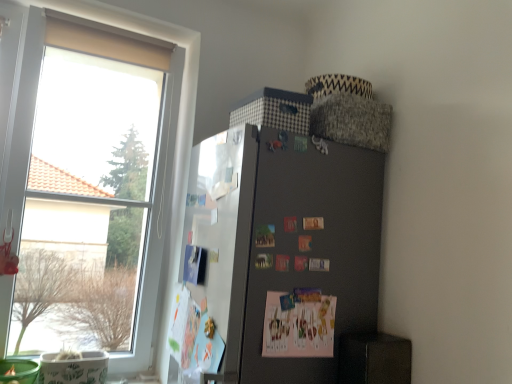
What do you see at coordinates (90, 156) in the screenshot? I see `transparent glass window at left` at bounding box center [90, 156].

Locate an element on the screen. The width and height of the screenshot is (512, 384). pink paper postcard at center is located at coordinates (298, 326).

Measure the distance between white paperboard at left and camera.

white paperboard at left and camera are 4.53 feet apart.

This screenshot has width=512, height=384. Find the location of `transparent glass window at left`. transparent glass window at left is located at coordinates pyautogui.click(x=90, y=156).

Based on the photo, considering the relative sizes of transparent glass window at left and white paperboard at left in the image provided, is transparent glass window at left shorter than white paperboard at left?

No, transparent glass window at left is not shorter than white paperboard at left.

Is transparent glass window at left to the left or to the right of white paperboard at left in the image?

transparent glass window at left is positioned on white paperboard at left's left side.

This screenshot has width=512, height=384. I want to click on bulletin board located underneath the transparent glass window at left (from a real-world perspective), so click(214, 259).

Is transparent glass window at left aimed at white paperboard at left?

Yes, transparent glass window at left is oriented towards white paperboard at left.

Is point (267, 360) positioned in front of point (196, 149)?

Yes, point (267, 360) is closer to viewer.

From the image's perspective, is satin black fridge at upper right located beneath white paperboard at left?

Indeed, from the image's perspective, satin black fridge at upper right is shown beneath white paperboard at left.

How different are the orientations of satin black fridge at upper right and white paperboard at left in degrees?

0.508 degrees separate the facing orientations of satin black fridge at upper right and white paperboard at left.

From a real-world perspective, is satin black fridge at upper right positioned over white paperboard at left based on gravity?

No, from a real-world perspective, satin black fridge at upper right is not over white paperboard at left

Which object is positioned more to the left, transparent glass window at left or pink paper postcard at center?

Positioned to the left is transparent glass window at left.

The width and height of the screenshot is (512, 384). In order to click on postcard on the right of transparent glass window at left in this screenshot , I will do `click(298, 326)`.

Is there a large distance between transparent glass window at left and pink paper postcard at center?

Yes.

From a real-world perspective, is transparent glass window at left positioned under pink paper postcard at center based on gravity?

No, from a real-world perspective, transparent glass window at left is not under pink paper postcard at center.

Which is correct: white paperboard at left is inside satin black fridge at upper right, or outside of it?

white paperboard at left fits inside satin black fridge at upper right.

From a real-world perspective, is white paperboard at left located beneath satin black fridge at upper right?

No.

Is white paperboard at left not close to satin black fridge at upper right?

Actually, white paperboard at left and satin black fridge at upper right are a little close together.

Looking at their sizes, would you say satin black fridge at upper right is wider or thinner than pink paper postcard at center?

satin black fridge at upper right is wider than pink paper postcard at center.

The height and width of the screenshot is (384, 512). In order to click on postcard that appears on the right of satin black fridge at upper right in this screenshot , I will do `click(298, 326)`.

From a real-world perspective, who is located higher, satin black fridge at upper right or pink paper postcard at center?

In real-world perspective, satin black fridge at upper right is above.

Is satin black fridge at upper right further to camera compared to pink paper postcard at center?

That is False.

Find the location of a particular element. The width and height of the screenshot is (512, 384). window above the pink paper postcard at center (from a real-world perspective) is located at coordinates (90, 156).

From the image's perspective, relative to transparent glass window at left, is pink paper postcard at center above or below?

pink paper postcard at center is situated lower than transparent glass window at left in the image.

Which object is wider, pink paper postcard at center or transparent glass window at left?

transparent glass window at left is wider.

From a real-world perspective, relative to satin black fridge at upper right, is pink paper postcard at center vertically above or below?

From a real-world perspective, pink paper postcard at center is physically below satin black fridge at upper right.

Is satin black fridge at upper right at the back of pink paper postcard at center?

Yes, pink paper postcard at center is positioned with its back facing satin black fridge at upper right.

What's the angular difference between pink paper postcard at center and satin black fridge at upper right's facing directions?

90.9 degrees.

From the image's perspective, which object appears higher, pink paper postcard at center or satin black fridge at upper right?

satin black fridge at upper right appears higher in the image.

You are a GUI agent. You are given a task and a screenshot of the screen. Output one action in this format:
    pyautogui.click(x=<x>, y=<y>)
    Task: Click on the window located behind the white paperboard at left
    The width and height of the screenshot is (512, 384).
    Given the screenshot: What is the action you would take?
    pyautogui.click(x=90, y=156)

Find the location of a particular element. The width and height of the screenshot is (512, 384). refrigerator lying on the right of white paperboard at left is located at coordinates (276, 256).

From the image, which object appears to be nearer to transparent glass window at left, satin black fridge at upper right or white paperboard at left?

white paperboard at left lies closer to transparent glass window at left than the other object.

Estimate the real-world distances between objects in this image. Which object is closer to pink paper postcard at center, transparent glass window at left or satin black fridge at upper right?

satin black fridge at upper right is positioned closer to the anchor pink paper postcard at center.

Estimate the real-world distances between objects in this image. Which object is closer to transparent glass window at left, pink paper postcard at center or satin black fridge at upper right?

Among the two, satin black fridge at upper right is located nearer to transparent glass window at left.

From the picture: From the image, which object appears to be farther from white paperboard at left, satin black fridge at upper right or transparent glass window at left?

Based on the image, transparent glass window at left appears to be further to white paperboard at left.

When comparing their distances from transparent glass window at left, does white paperboard at left or pink paper postcard at center seem further?

pink paper postcard at center.

Estimate the real-world distances between objects in this image. Which object is further from pink paper postcard at center, white paperboard at left or transparent glass window at left?

Among the two, transparent glass window at left is located further to pink paper postcard at center.

Looking at the image, which one is located further to pink paper postcard at center, satin black fridge at upper right or white paperboard at left?

white paperboard at left is further to pink paper postcard at center.

When comparing their distances from satin black fridge at upper right, does pink paper postcard at center or transparent glass window at left seem closer?

pink paper postcard at center is positioned closer to the anchor satin black fridge at upper right.

This screenshot has height=384, width=512. In order to click on refrigerator between transparent glass window at left and pink paper postcard at center in the horizontal direction in this screenshot , I will do tap(276, 256).

Find the location of `refrigerator between white paperboard at left and pink paper postcard at center in the horizontal direction`. refrigerator between white paperboard at left and pink paper postcard at center in the horizontal direction is located at coordinates (276, 256).

Locate an element on the screen. Image resolution: width=512 pixels, height=384 pixels. bulletin board between transparent glass window at left and satin black fridge at upper right from left to right is located at coordinates (214, 259).

Image resolution: width=512 pixels, height=384 pixels. Identify the location of bulletin board between transparent glass window at left and pink paper postcard at center. (214, 259).